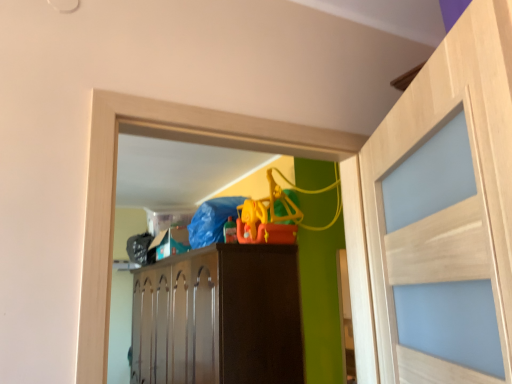
Question: Considering the positions of light wood door at right and brown wood cabinet at center in the image, is light wood door at right taller or shorter than brown wood cabinet at center?

Choices:
 (A) tall
 (B) short

Answer: (B)

Question: Is point (501, 289) closer or farther from the camera than point (224, 349)?

Choices:
 (A) closer
 (B) farther

Answer: (A)

Question: Would you say light wood door at right is to the left or to the right of brown wood cabinet at center in the picture?

Choices:
 (A) left
 (B) right

Answer: (B)

Question: Is brown wood cabinet at center bigger or smaller than light wood door at right?

Choices:
 (A) big
 (B) small

Answer: (A)

Question: In terms of width, does brown wood cabinet at center look wider or thinner when compared to light wood door at right?

Choices:
 (A) wide
 (B) thin

Answer: (A)

Question: Does point (168, 324) appear closer or farther from the camera than point (425, 152)?

Choices:
 (A) farther
 (B) closer

Answer: (A)

Question: From the image's perspective, is brown wood cabinet at center above or below light wood door at right?

Choices:
 (A) below
 (B) above

Answer: (A)